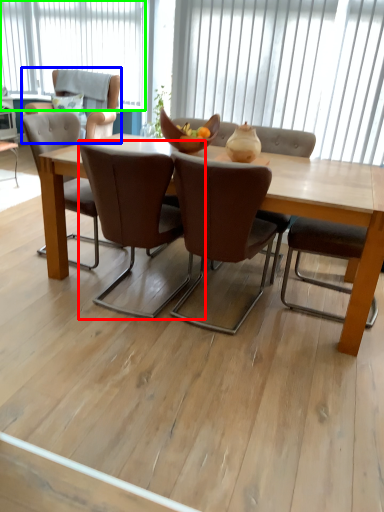
Question: Which is nearer to the chair (highlighted by a red box)? armchair (highlighted by a blue box) or window (highlighted by a green box).

Choices:
 (A) armchair
 (B) window

Answer: (A)